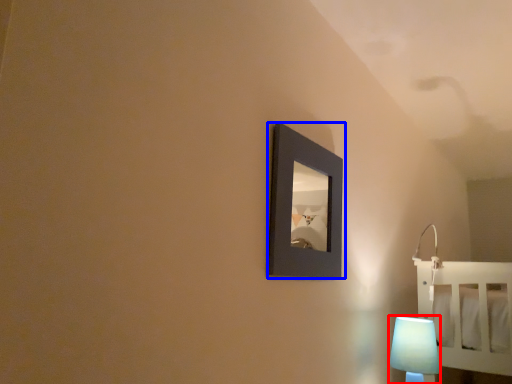
Question: Among these objects, which one is farthest to the camera, lamp (highlighted by a red box) or picture frame (highlighted by a blue box)?

Choices:
 (A) lamp
 (B) picture frame

Answer: (A)